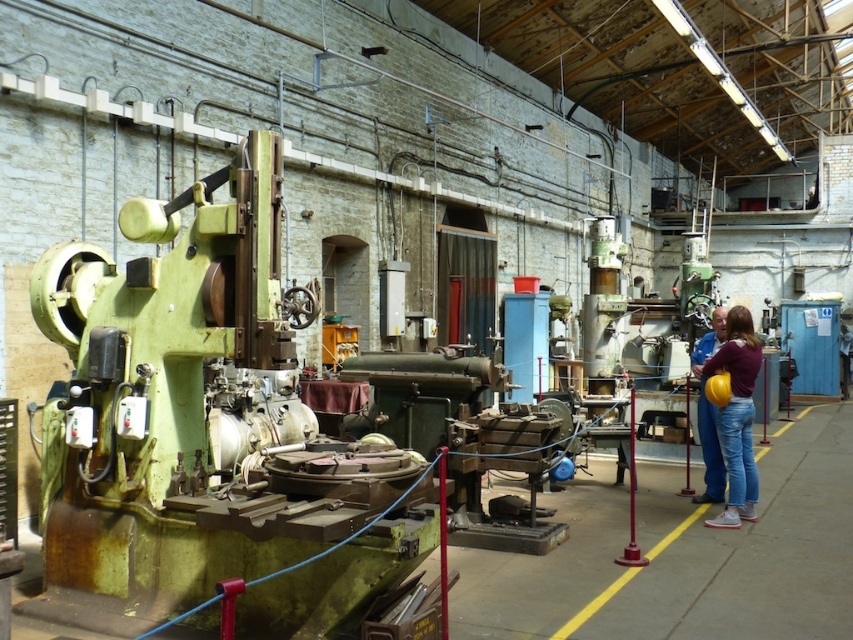
In the scene shown: Does maroon fabric shirt at center have a lesser height compared to denim jeans at lower right?

In fact, maroon fabric shirt at center may be taller than denim jeans at lower right.

Which is below, maroon fabric shirt at center or denim jeans at lower right?

denim jeans at lower right

Between point (729, 336) and point (706, 486), which one is positioned in front?

Point (729, 336) is in front.

At what (x,y) coordinates should I click in order to perform the action: click on maroon fabric shirt at center. Please return your answer as a coordinate pair (x, y). Looking at the image, I should click on (735, 417).

The height and width of the screenshot is (640, 853). What do you see at coordinates (209, 428) in the screenshot? I see `green metallic machine at left` at bounding box center [209, 428].

Is green metallic machine at left to the right of maroon fabric shirt at center from the viewer's perspective?

In fact, green metallic machine at left is to the left of maroon fabric shirt at center.

Find the location of a particular element. The image size is (853, 640). green metallic machine at left is located at coordinates (209, 428).

Between green metallic machine at left and denim jeans at lower right, which one is positioned lower?

green metallic machine at left is lower down.

Which of these two, green metallic machine at left or denim jeans at lower right, stands taller?

green metallic machine at left

Is point (59, 337) in front of point (715, 500)?

Yes, it is.

Locate an element on the screen. This screenshot has height=640, width=853. green metallic machine at left is located at coordinates (209, 428).